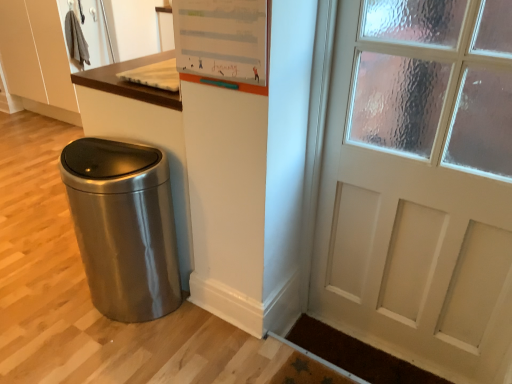
Image resolution: width=512 pixels, height=384 pixels. I want to click on free space in front of satin metallic trash can at lower left, so click(x=96, y=359).